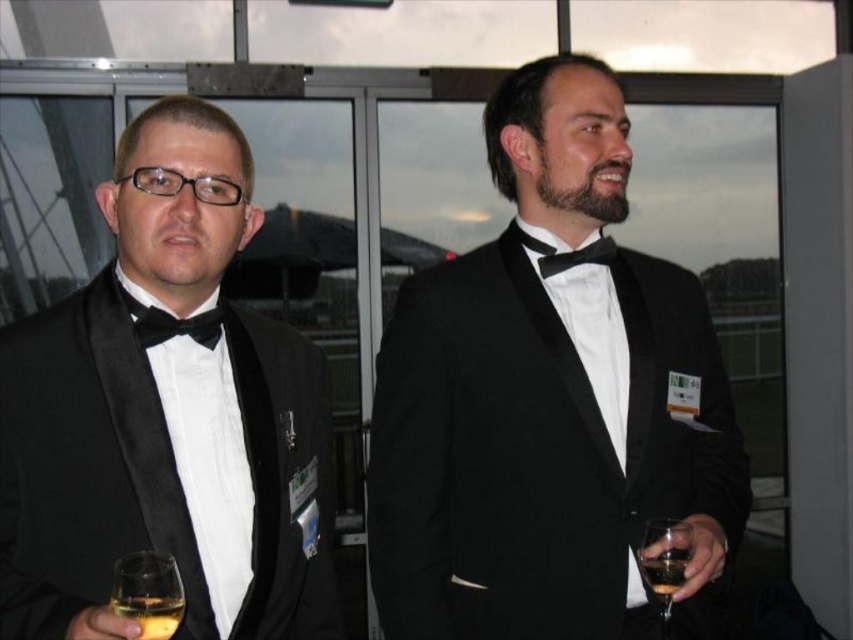
You are standing in a room with two men in tuxedos near large glass windows. There is a point at coordinates point (x=660, y=358). Can you determine if this point is closer to you than 5 feet?

The distance of point (x=660, y=358) from viewer is 4.81 feet, so yes, the point is closer than 5 feet.

You are a photographer at a formal event. You need to position a spotlight exactly at the point with coordinates point (548,403). What object should you expect the spotlight to illuminate?

The spotlight positioned at point (548,403) will illuminate the black satin tuxedo at center.

You are standing in the room with the two men and want to move towards the closer point between point (554,374) and point (645,570). Which point should you walk towards?

You should walk towards point (554,374) because it is closer to you than point (645,570).